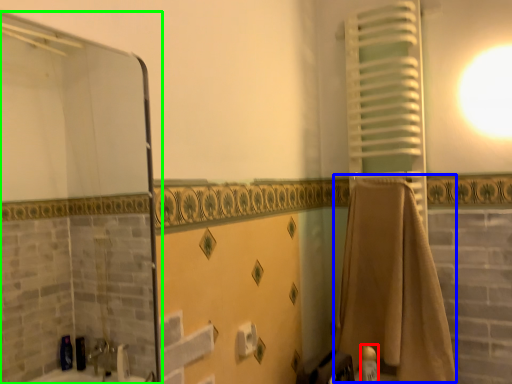
Question: Estimate the real-world distances between objects in this image. Which object is farther from toiletry (highlighted by a red box), bath towel (highlighted by a blue box) or screen door (highlighted by a green box)?

Choices:
 (A) bath towel
 (B) screen door

Answer: (B)